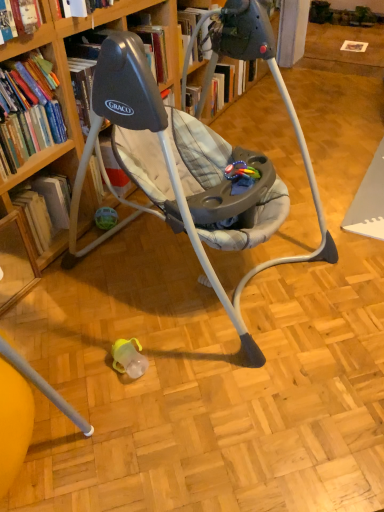
Question: Considering the relative sizes of hardcover book at left, which is the first book in bottom-to-top order, and hardcover book at left, placed as the first book when sorted from top to bottom, in the image provided, is hardcover book at left, which is the first book in bottom-to-top order, shorter than hardcover book at left, placed as the first book when sorted from top to bottom,?

Choices:
 (A) no
 (B) yes

Answer: (B)

Question: Are hardcover book at left, which is the first book in bottom-to-top order, and hardcover book at left, placed as the first book when sorted from top to bottom, beside each other?

Choices:
 (A) no
 (B) yes

Answer: (A)

Question: Is hardcover book at left, which is the first book in bottom-to-top order, far away from hardcover book at left, placed as the first book when sorted from top to bottom?

Choices:
 (A) yes
 (B) no

Answer: (B)

Question: Does hardcover book at left, positioned as the 2th book in top-to-bottom order, have a lesser width compared to hardcover book at left, placed as the first book when sorted from top to bottom?

Choices:
 (A) yes
 (B) no

Answer: (B)

Question: From the image's perspective, is hardcover book at left, positioned as the 2th book in top-to-bottom order, located above hardcover book at left, which is counted as the 2th book, starting from the bottom?

Choices:
 (A) yes
 (B) no

Answer: (B)

Question: Considering the relative sizes of hardcover book at left, which is the first book in bottom-to-top order, and hardcover book at left, placed as the first book when sorted from top to bottom, in the image provided, is hardcover book at left, which is the first book in bottom-to-top order, wider than hardcover book at left, placed as the first book when sorted from top to bottom,?

Choices:
 (A) yes
 (B) no

Answer: (A)

Question: Is hardcover book at left, positioned as the 2th book in top-to-bottom order, inside wooden bookcase at upper left?

Choices:
 (A) yes
 (B) no

Answer: (B)

Question: Can you confirm if wooden bookcase at upper left is smaller than hardcover book at left, which is the first book in bottom-to-top order?

Choices:
 (A) no
 (B) yes

Answer: (A)

Question: Considering the relative positions of wooden bookcase at upper left and hardcover book at left, which is the first book in bottom-to-top order, in the image provided, is wooden bookcase at upper left behind hardcover book at left, which is the first book in bottom-to-top order,?

Choices:
 (A) no
 (B) yes

Answer: (A)

Question: Would you say wooden bookcase at upper left is a long distance from hardcover book at left, which is the first book in bottom-to-top order?

Choices:
 (A) no
 (B) yes

Answer: (A)

Question: Is wooden bookcase at upper left positioned with its back to hardcover book at left, which is the first book in bottom-to-top order?

Choices:
 (A) no
 (B) yes

Answer: (B)

Question: Is wooden bookcase at upper left bigger than hardcover book at left, which is the first book in bottom-to-top order?

Choices:
 (A) no
 (B) yes

Answer: (B)

Question: Are hardcover book at left, which is counted as the 2th book, starting from the bottom, and hardcover book at left, which is the first book in bottom-to-top order, beside each other?

Choices:
 (A) no
 (B) yes

Answer: (A)